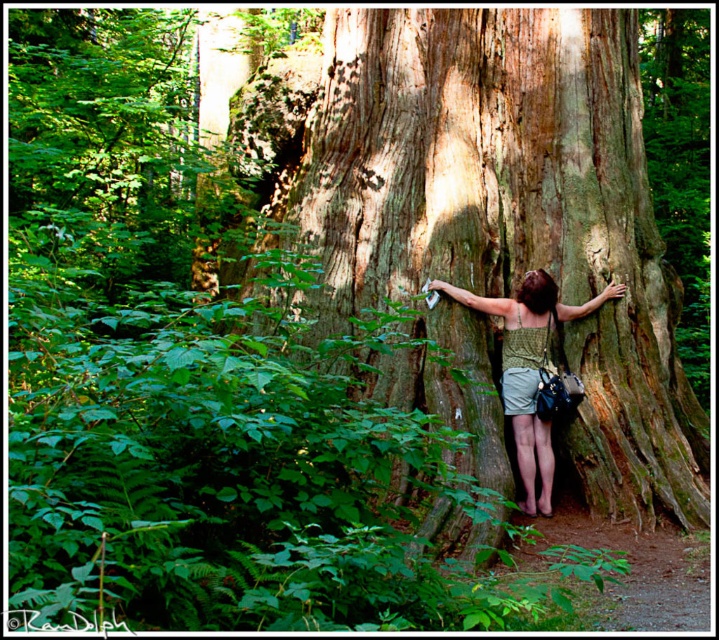
Question: Which point is closer to the camera?

Choices:
 (A) tap(457, 38)
 (B) tap(503, 349)

Answer: (B)

Question: Is smooth brown bark at center wider than green textured dress at center?

Choices:
 (A) yes
 (B) no

Answer: (A)

Question: Does smooth brown bark at center have a smaller size compared to green textured dress at center?

Choices:
 (A) yes
 (B) no

Answer: (B)

Question: Which point appears farthest from the camera in this image?

Choices:
 (A) (551, 282)
 (B) (695, 442)

Answer: (B)

Question: Can you confirm if smooth brown bark at center is positioned to the left of green textured dress at center?

Choices:
 (A) no
 (B) yes

Answer: (A)

Question: Which point is farther to the camera?

Choices:
 (A) (516, 456)
 (B) (331, 294)

Answer: (B)